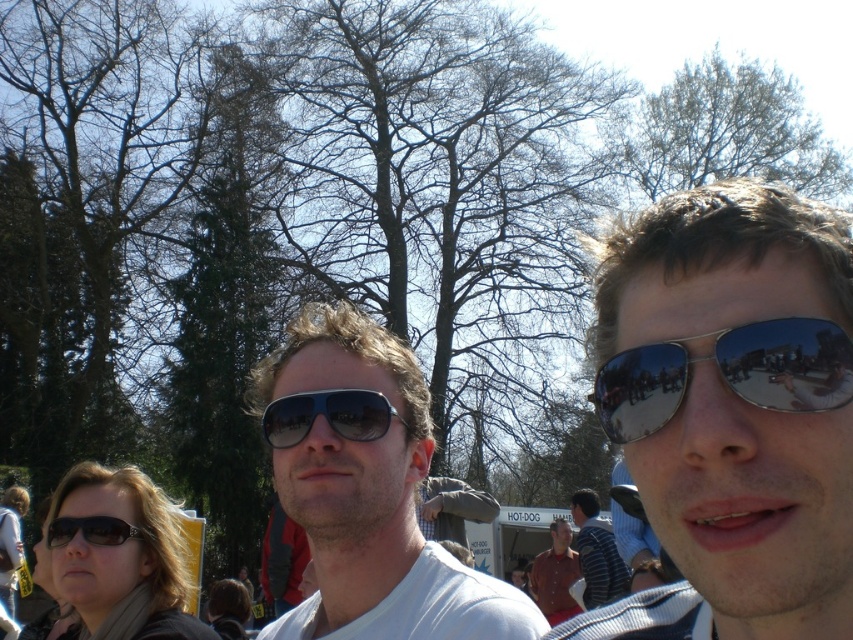
You are taking a photo of the two people in the scene. You notice the silver reflective sunglasses at right and the matte black sunglasses at center. Which pair of sunglasses will appear larger in your photo?

The silver reflective sunglasses at right will appear larger in the photo because it is closer to the viewer than the matte black sunglasses at center.

You are standing in the park and see the matte white shirt at center and the matte black sunglasses at center. From your perspective, which one is positioned more to the left?

The matte white shirt at center is positioned to the left of the matte black sunglasses at center, so the matte white shirt at center is more to the left.

You are a photographer trying to capture a clear shot of the matte brown shirt at center and the sunglasses at center. Since you want to focus on the shirt, which object should you adjust your camera lens to focus on first?

The sunglasses at center is shorter than matte brown shirt at center, so you should focus on the matte brown shirt at center first because it is taller and more prominent in the frame.